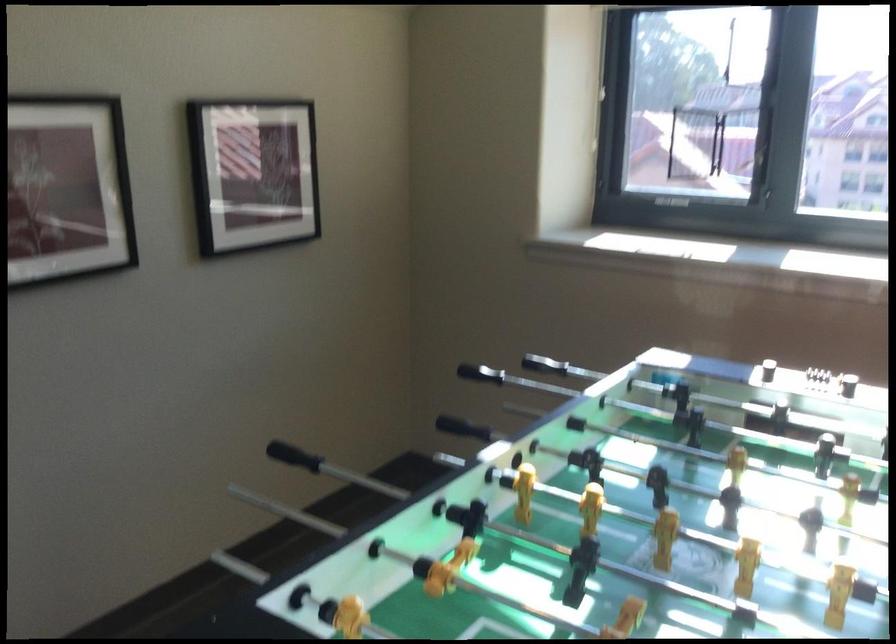
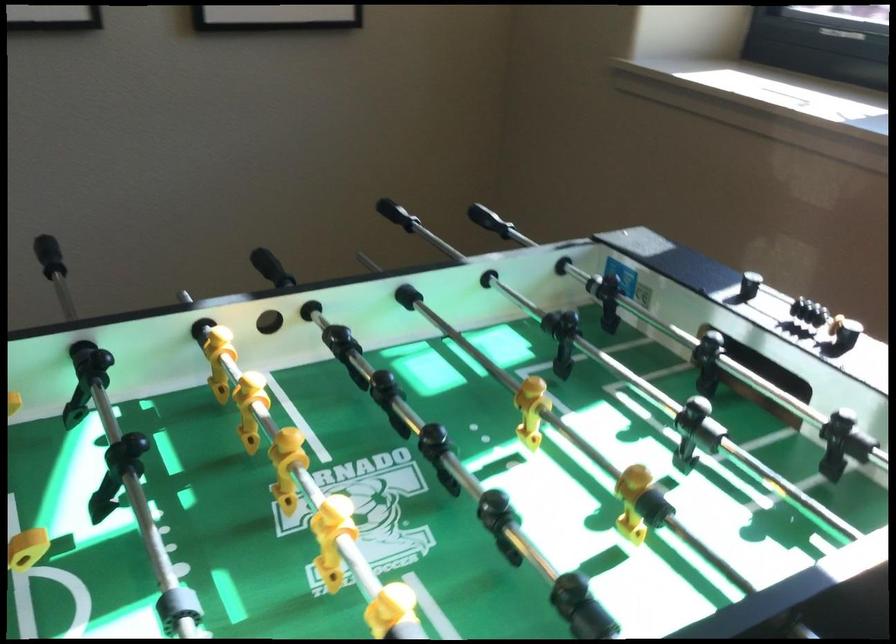
Find the pixel in the second image that matches point (410, 375) in the first image.

(488, 220)